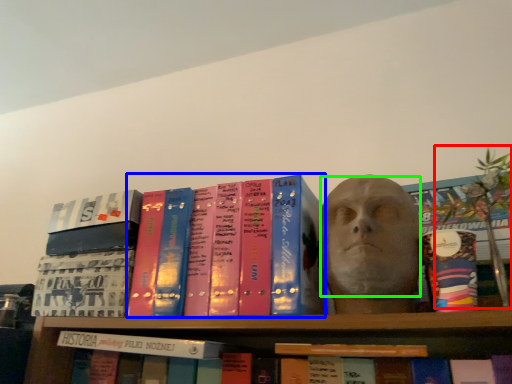
Question: Which object is positioned farthest from plant (highlighted by a red box)? Select from book (highlighted by a blue box) and human face (highlighted by a green box).

Choices:
 (A) book
 (B) human face

Answer: (A)